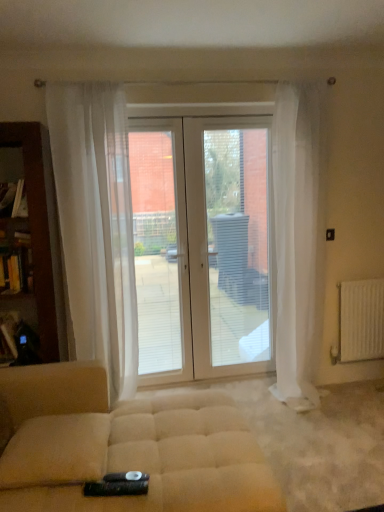
Question: Considering the relative sizes of white glossy door at center and beige fabric ottoman at center in the image provided, is white glossy door at center smaller than beige fabric ottoman at center?

Choices:
 (A) no
 (B) yes

Answer: (B)

Question: From a real-world perspective, does white glossy door at center sit lower than beige fabric ottoman at center?

Choices:
 (A) yes
 (B) no

Answer: (B)

Question: Can you confirm if white glossy door at center is positioned to the right of beige fabric ottoman at center?

Choices:
 (A) no
 (B) yes

Answer: (B)

Question: Can you confirm if white glossy door at center is shorter than beige fabric ottoman at center?

Choices:
 (A) yes
 (B) no

Answer: (B)

Question: Is white glossy door at center looking in the opposite direction of beige fabric ottoman at center?

Choices:
 (A) yes
 (B) no

Answer: (B)

Question: Considering the positions of sheer white curtain at center, placed as the second curtain when sorted from right to left, and beige fabric ottoman at center in the image, is sheer white curtain at center, placed as the second curtain when sorted from right to left, wider or thinner than beige fabric ottoman at center?

Choices:
 (A) wide
 (B) thin

Answer: (B)

Question: Is point (51, 93) positioned closer to the camera than point (89, 367)?

Choices:
 (A) farther
 (B) closer

Answer: (A)

Question: From a real-world perspective, is sheer white curtain at center, placed as the second curtain when sorted from right to left, positioned above or below beige fabric ottoman at center?

Choices:
 (A) below
 (B) above

Answer: (B)

Question: Is sheer white curtain at center, placed as the second curtain when sorted from right to left, taller or shorter than beige fabric ottoman at center?

Choices:
 (A) short
 (B) tall

Answer: (B)

Question: From their relative heights in the image, would you say white sheer curtain at right, the second curtain viewed from the left, is taller or shorter than sheer white curtain at center, placed as the second curtain when sorted from right to left?

Choices:
 (A) tall
 (B) short

Answer: (A)

Question: Is white sheer curtain at right, the second curtain viewed from the left, situated inside sheer white curtain at center, placed as the second curtain when sorted from right to left, or outside?

Choices:
 (A) outside
 (B) inside

Answer: (A)

Question: Considering the positions of white sheer curtain at right, which ranks as the 1th curtain in right-to-left order, and sheer white curtain at center, which ranks as the first curtain in left-to-right order, in the image, is white sheer curtain at right, which ranks as the 1th curtain in right-to-left order, bigger or smaller than sheer white curtain at center, which ranks as the first curtain in left-to-right order,?

Choices:
 (A) small
 (B) big

Answer: (A)

Question: Looking at their shapes, would you say white sheer curtain at right, the second curtain viewed from the left, is wider or thinner than sheer white curtain at center, placed as the second curtain when sorted from right to left?

Choices:
 (A) thin
 (B) wide

Answer: (B)

Question: Is brown wood bookshelf at left inside the boundaries of beige fabric ottoman at center, or outside?

Choices:
 (A) inside
 (B) outside

Answer: (B)

Question: Looking at their shapes, would you say brown wood bookshelf at left is wider or thinner than beige fabric ottoman at center?

Choices:
 (A) wide
 (B) thin

Answer: (B)